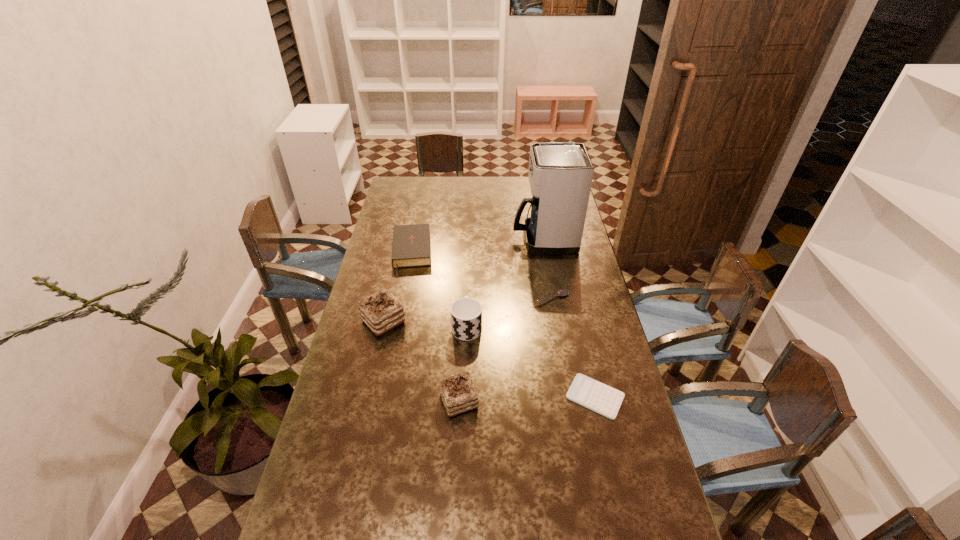
Find the location of a particular element. Image resolution: width=960 pixels, height=540 pixels. vacant space that satisfies the following two spatial constraints: 1. on the front panel of the tallest object; 2. on the left side of the calculator is located at coordinates (573, 397).